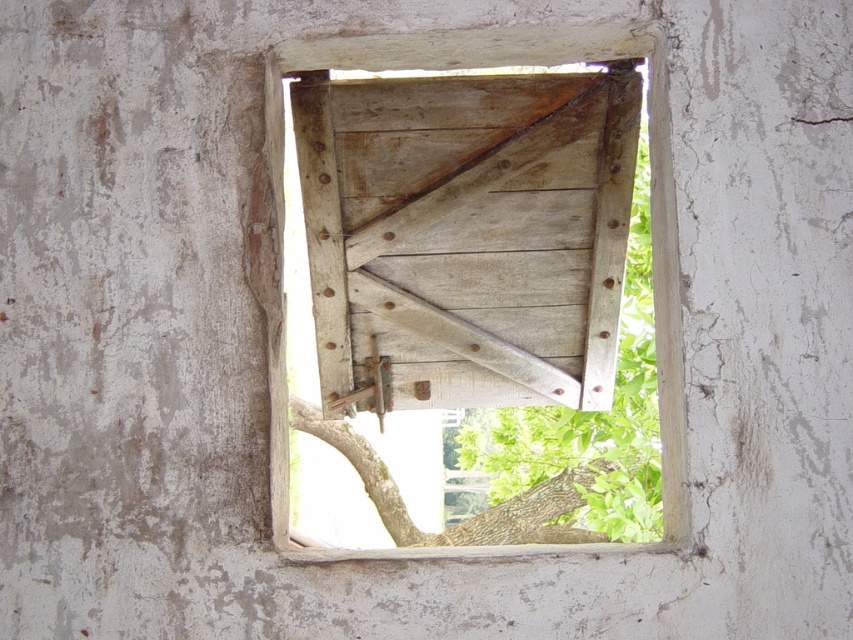
Is wooden frame at center closer to camera compared to wooden hinge at center?

Yes, wooden frame at center is in front of wooden hinge at center.

Which of these two, wooden frame at center or wooden hinge at center, stands taller?

With more height is wooden frame at center.

Which is in front, point (383, 282) or point (323, 173)?

Point (323, 173) is more forward.

Find the location of a particular element. This screenshot has width=853, height=640. wooden frame at center is located at coordinates (462, 216).